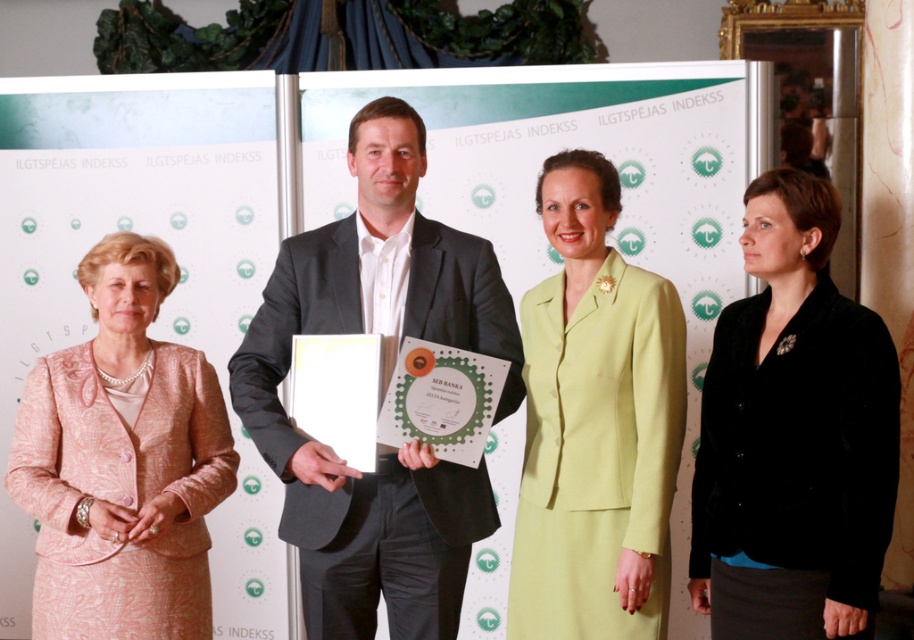
You are standing in front of the backdrop at the formal event. You notice two points marked in the scene. Which point, point [711,380] or point [284,310], is closer to you?

Point [711,380] is closer to the viewer than point [284,310].

You are organizing a formal event and need to arrange seating based on the width of the attendees clothing. The black velvet blazer at right and the dark gray suit at center are two outfits present. Which attendee should sit in a narrower chair designed for thinner clothing?

The black velvet blazer at right is thinner than the dark gray suit at center, so the attendee wearing the black velvet blazer at right should sit in the narrower chair designed for thinner clothing.

You are attending a formal event and notice two attendees wearing the black velvet blazer at right and the pink textured suit at left. From your perspective, which attendee is closer to you?

The black velvet blazer at right is closer to you because it is positioned in front of the pink textured suit at left.